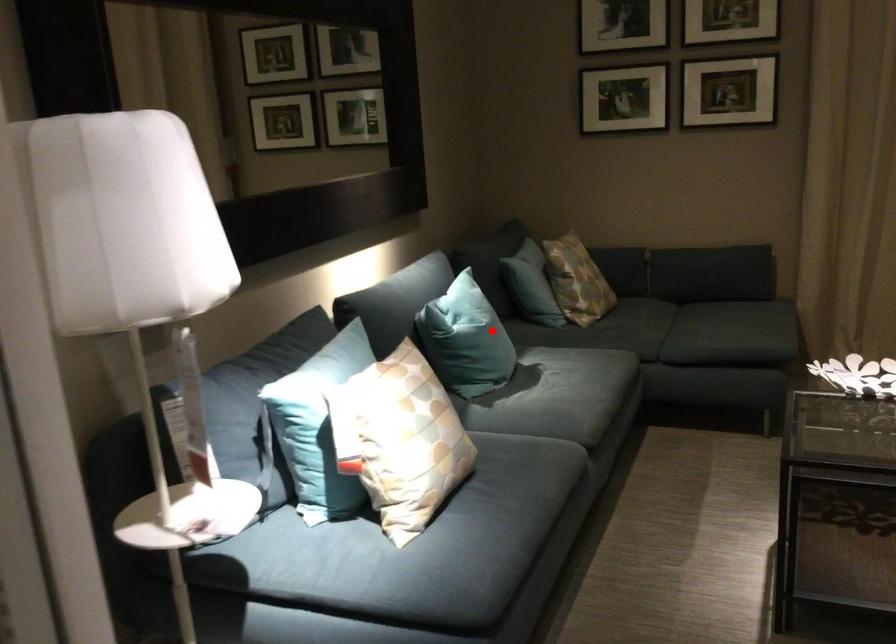
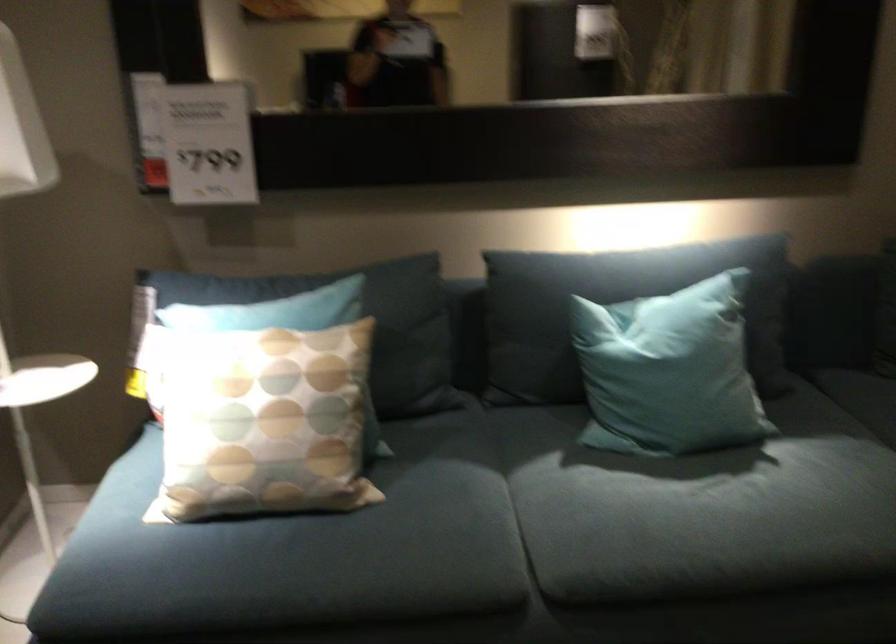
Question: A red point is marked in image1. In image2, is the corresponding 3D point closer to the camera or farther? Reply with the corresponding letter.

Choices:
 (A) The corresponding 3D point is closer.
 (B) The corresponding 3D point is farther.

Answer: (A)